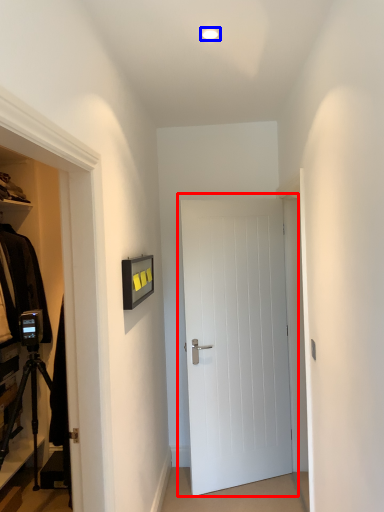
Question: Which point is further to the camera, door (highlighted by a red box) or lighting (highlighted by a blue box)?

Choices:
 (A) door
 (B) lighting

Answer: (A)